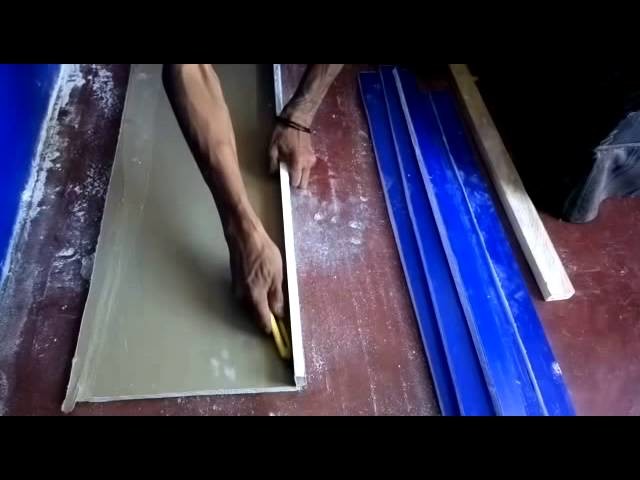
Find the location of a particular element. Image resolution: width=640 pixels, height=480 pixels. colored wood is located at coordinates coord(393,209), coord(424,207), coord(441,199), coord(489,197).